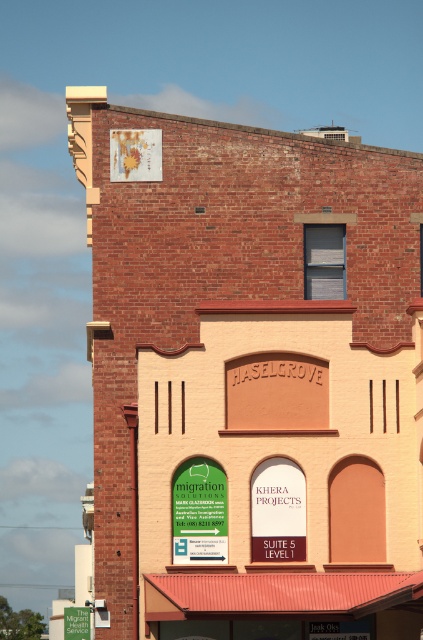
You are a painter who needs to choose between painting the brick building at center or the metallic red awning at lower center. Which object would require more paint due to its size?

The brick building at center is bigger than the metallic red awning at lower center, so it would require more paint.

You are standing 100 meters away from the building. You want to take a photo of the point at coordinate (375, 189) on the building. Is the camera close enough to capture the point clearly?

The point at coordinate (375, 189) is 82.64 meters away from the camera, which is within the 100 meters distance you mentioned. Therefore, the camera is close enough to capture the point clearly.